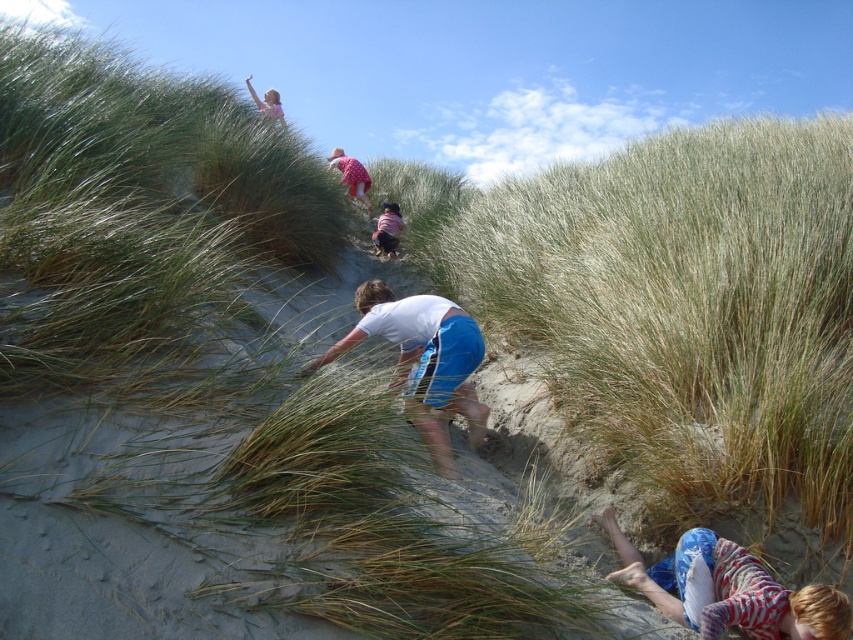
Who is shorter, striped cotton shirt at lower right or dark purple shirt at center?

With less height is striped cotton shirt at lower right.

Who is lower down, striped cotton shirt at lower right or dark purple shirt at center?

striped cotton shirt at lower right

Is point (767, 624) behind point (392, 241)?

No, (767, 624) is closer to viewer.

Where is `striped cotton shirt at lower right`? This screenshot has width=853, height=640. striped cotton shirt at lower right is located at coordinates (726, 589).

Is white cotton shirt at center below pink fabric dress at upper center?

Correct, white cotton shirt at center is located below pink fabric dress at upper center.

Which is in front, point (428, 433) or point (335, 168)?

Point (428, 433)

This screenshot has height=640, width=853. I want to click on white cotton shirt at center, so coord(422,360).

Who is positioned more to the left, white cotton shirt at center or dark purple shirt at center?

From the viewer's perspective, dark purple shirt at center appears more on the left side.

From the picture: Is white cotton shirt at center bigger than dark purple shirt at center?

Indeed, white cotton shirt at center has a larger size compared to dark purple shirt at center.

Measure the distance between white cotton shirt at center and camera.

white cotton shirt at center and camera are 3.69 meters apart.

Where is `white cotton shirt at center`? white cotton shirt at center is located at coordinates (422, 360).